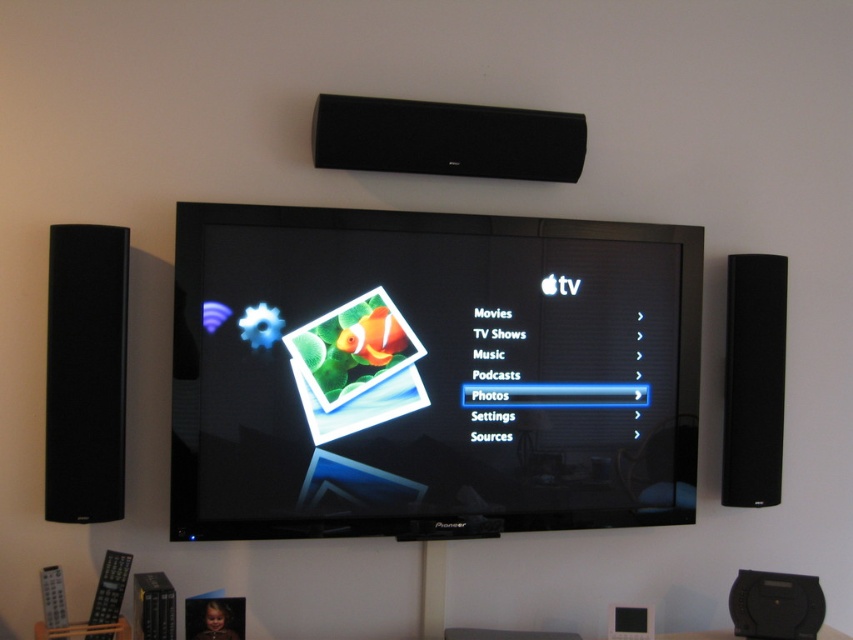
Question: Based on their relative distances, which object is farther from the black matte speaker at left?

Choices:
 (A) black matte speaker at upper center
 (B) black plastic speaker at lower right
 (C) black matte speaker at right
 (D) black glossy tv at center

Answer: (B)

Question: Is black matte speaker at upper center smaller than black matte speaker at right?

Choices:
 (A) yes
 (B) no

Answer: (B)

Question: Does black glossy tv at center appear over black matte speaker at left?

Choices:
 (A) yes
 (B) no

Answer: (B)

Question: Which point is closer to the camera?

Choices:
 (A) (50, 358)
 (B) (459, 472)

Answer: (A)

Question: Is the position of black matte speaker at upper center more distant than that of black plastic speaker at lower right?

Choices:
 (A) yes
 (B) no

Answer: (B)

Question: Among these objects, which one is nearest to the camera?

Choices:
 (A) black matte speaker at upper center
 (B) black glossy tv at center
 (C) black matte speaker at right

Answer: (B)